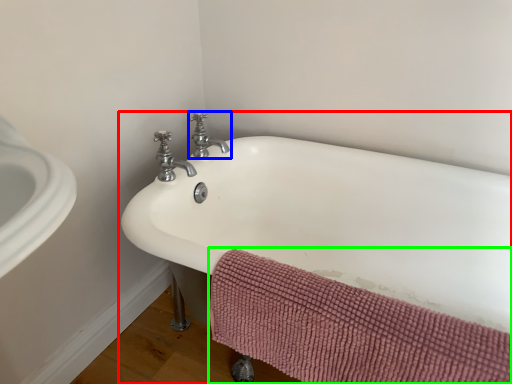
Question: Which object is positioned farthest from bathtub (highlighted by a red box)? Select from tap (highlighted by a blue box) and bath towel (highlighted by a green box).

Choices:
 (A) tap
 (B) bath towel

Answer: (A)